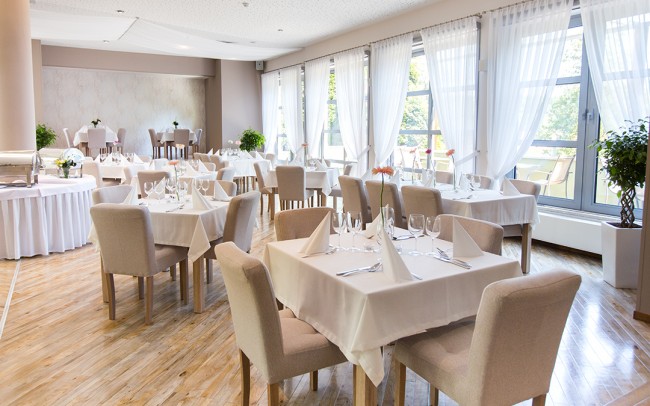
Find the location of a particular element. Image resolution: width=650 pixels, height=406 pixels. white curtain panels is located at coordinates click(274, 109), click(287, 102), click(313, 98), click(357, 93), click(396, 71), click(458, 72), click(517, 56), click(611, 58).